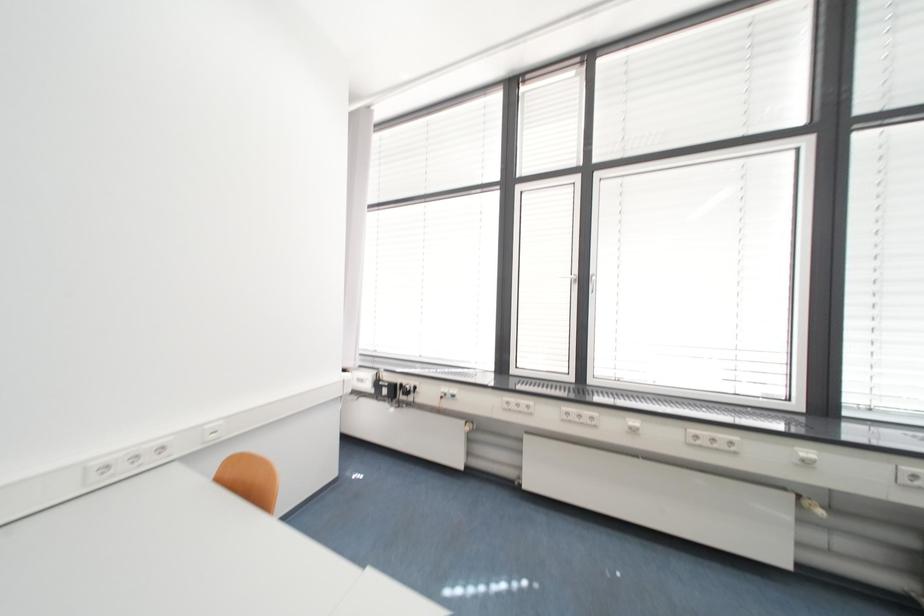
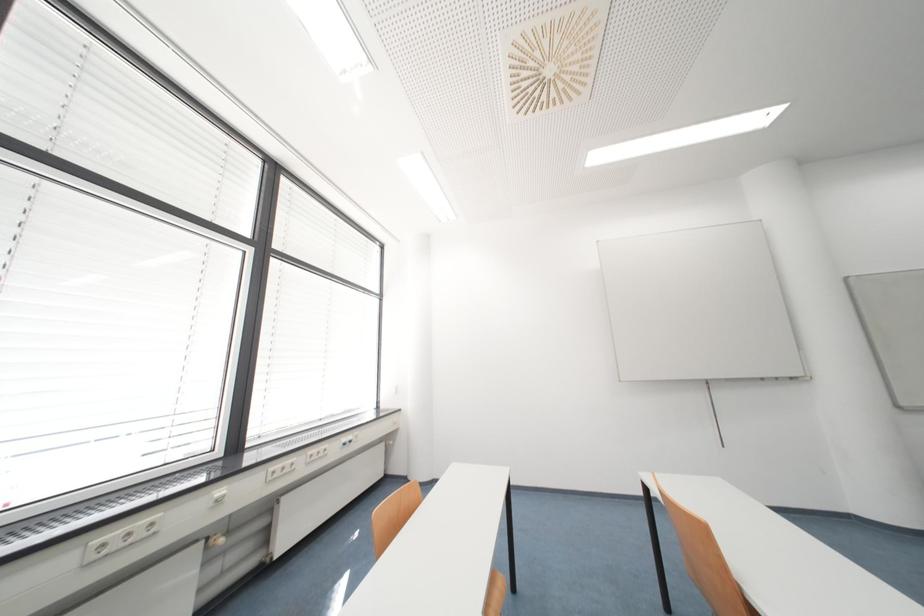
Question: The first image is from the beginning of the video and the second image is from the end. How did the camera likely rotate when shooting the video?

Choices:
 (A) Left
 (B) Right
 (C) Up
 (D) Down

Answer: (B)